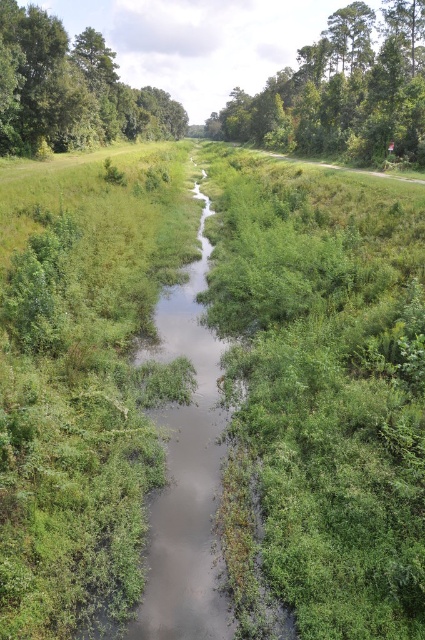
I want to click on green leafy tree at upper center, so click(342, 92).

Can you confirm if green leafy tree at upper center is shorter than green leafy tree at upper left?

Incorrect, green leafy tree at upper center's height does not fall short of green leafy tree at upper left's.

Is point (391, 113) closer to camera compared to point (113, 54)?

Yes, point (391, 113) is in front of point (113, 54).

You are a GUI agent. You are given a task and a screenshot of the screen. Output one action in this format:
    pyautogui.click(x=<x>, y=<y>)
    Task: Click on the green leafy tree at upper center
    This screenshot has width=425, height=640.
    Given the screenshot: What is the action you would take?
    342,92